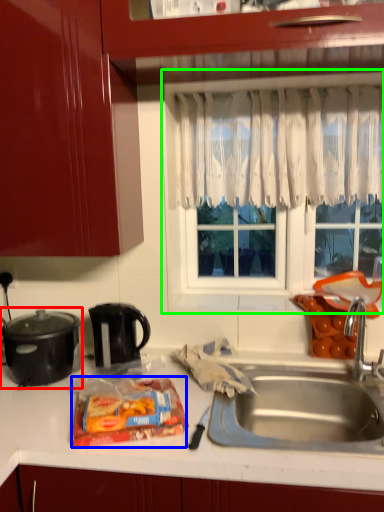
Question: Which object is positioned closest to kitchen appliance (highlighted by a red box)? Select from snack (highlighted by a blue box) and window frame (highlighted by a green box).

Choices:
 (A) snack
 (B) window frame

Answer: (A)